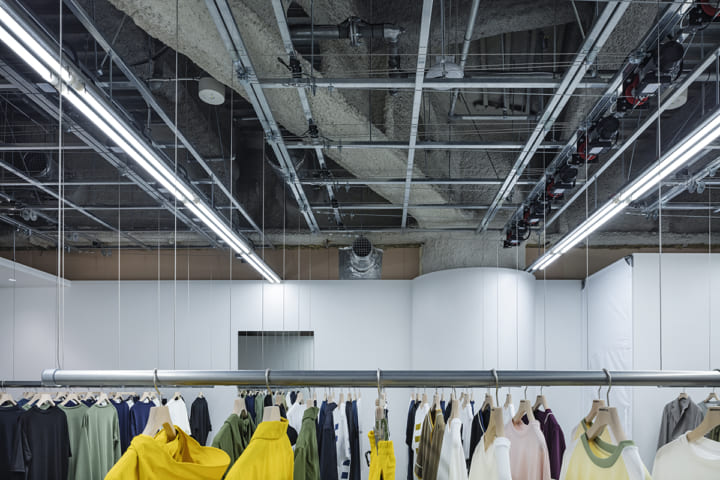
You are a GUI agent. You are given a task and a screenshot of the screen. Output one action in this format:
    pyautogui.click(x=<x>, y=<y>)
    Task: Click on the rack
    The width and height of the screenshot is (720, 480).
    Given the screenshot: What is the action you would take?
    pyautogui.click(x=476, y=377)